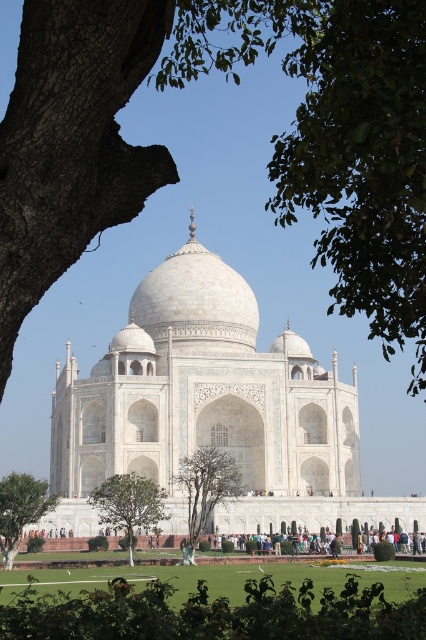
Identify the location of green leafy tree at upper center. This screenshot has height=640, width=426. (339, 140).

Is point (282, 10) farther from camera compared to point (31, 177)?

That is True.

Is point (178, 33) positioned after point (40, 109)?

Yes, it is behind point (40, 109).

Where is `green leafy tree at upper center`? The image size is (426, 640). green leafy tree at upper center is located at coordinates click(x=339, y=140).

Who is positioned more to the right, smooth bark tree at left or green leafy tree at center?

Positioned to the right is green leafy tree at center.

Is point (37, 291) positioned before point (201, 451)?

Yes.

Between point (48, 145) and point (210, 484), which one is positioned in front?

Point (48, 145) is in front.

Find the location of a particular element. This screenshot has height=640, width=426. smooth bark tree at left is located at coordinates (71, 141).

Can you confirm if smooth bark tree at left is wider than green leafy tree at lower center?

In fact, smooth bark tree at left might be narrower than green leafy tree at lower center.

Is smooth bark tree at left below green leafy tree at lower center?

No, smooth bark tree at left is not below green leafy tree at lower center.

Does point (100, 38) come farther from viewer compared to point (131, 477)?

That is False.

The image size is (426, 640). In order to click on smooth bark tree at left in this screenshot , I will do `click(71, 141)`.